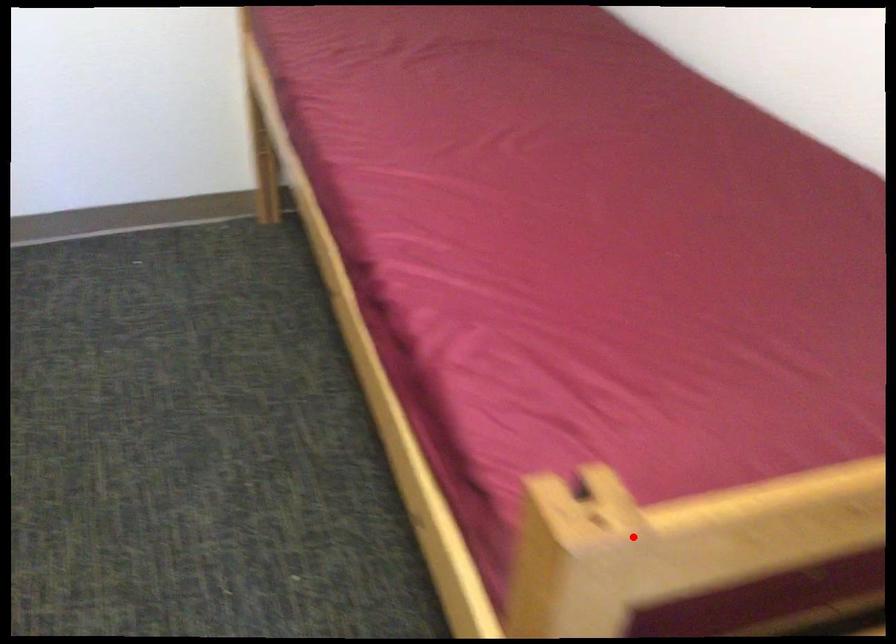
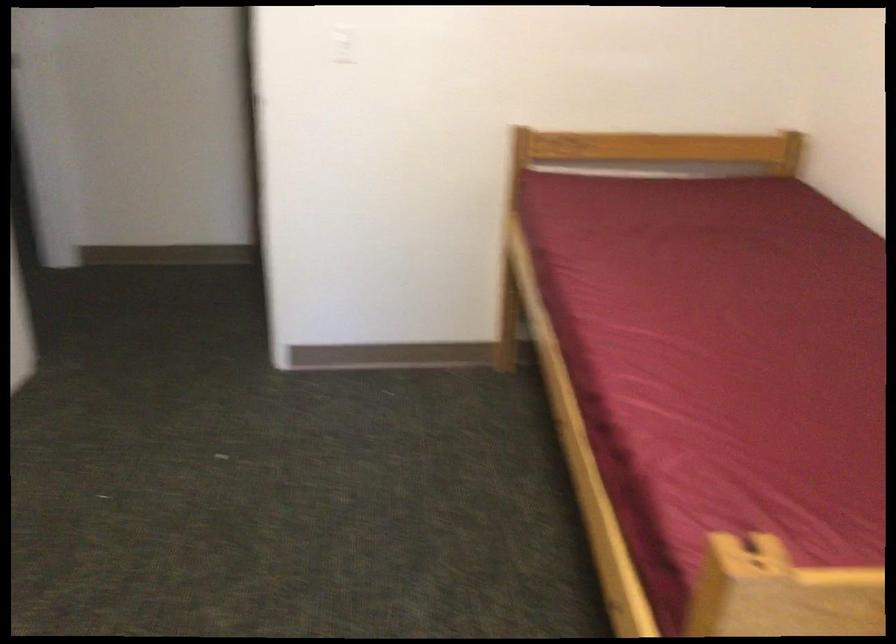
The point at the highlighted location is marked in the first image. Where is the corresponding point in the second image?

(805, 603)